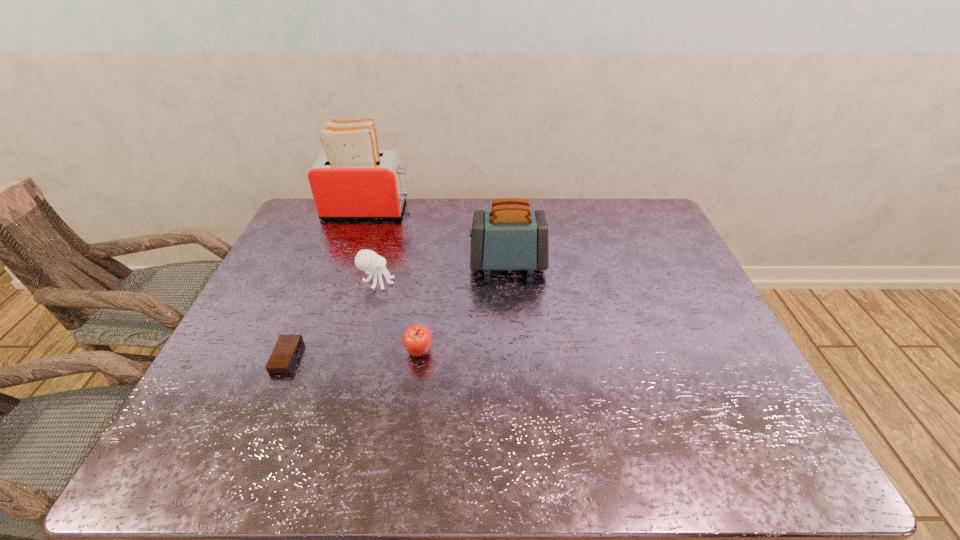
I want to click on blank space at the near edge of the desktop, so click(x=379, y=467).

This screenshot has width=960, height=540. I want to click on vacant space at the left edge of the desktop, so click(271, 310).

In the image, there is a desktop. At what (x,y) coordinates should I click in order to perform the action: click on vacant space at the right edge. Please return your answer as a coordinate pair (x, y). This screenshot has width=960, height=540. Looking at the image, I should click on (674, 251).

Image resolution: width=960 pixels, height=540 pixels. Identify the location of vacant position at the near left corner of the desktop. [238, 442].

Where is `vacant space at the far right corner of the desktop`? vacant space at the far right corner of the desktop is located at coordinates (636, 232).

Find the location of a particular element. free point between the second object from right to left and the nearer toaster is located at coordinates (464, 308).

At what (x,y) coordinates should I click in order to perform the action: click on free space between the fourth shortest object and the farthest object. Please return your answer as a coordinate pair (x, y). This screenshot has width=960, height=540. Looking at the image, I should click on (x=438, y=237).

At what (x,y) coordinates should I click in order to perform the action: click on vacant space in between the farthest object and the octopus. Please return your answer as a coordinate pair (x, y). The width and height of the screenshot is (960, 540). Looking at the image, I should click on 372,246.

Locate an element on the screen. The image size is (960, 540). free area in between the rightmost object and the second shortest object is located at coordinates (464, 308).

At what (x,y) coordinates should I click in order to perform the action: click on free space between the nearer toaster and the fourth object from left to right. Please return your answer as a coordinate pair (x, y). Image resolution: width=960 pixels, height=540 pixels. Looking at the image, I should click on (464, 308).